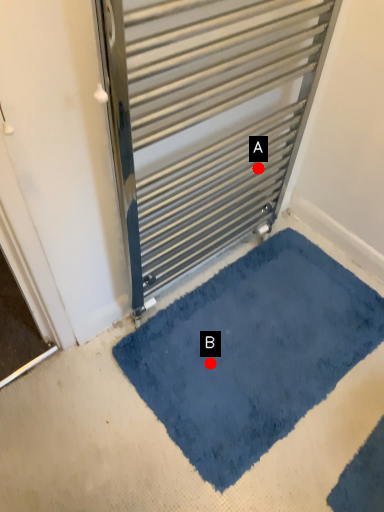
Question: Two points are circled on the image, labeled by A and B beside each circle. Which of the following is the farthest from the observer?

Choices:
 (A) A is further
 (B) B is further

Answer: (A)